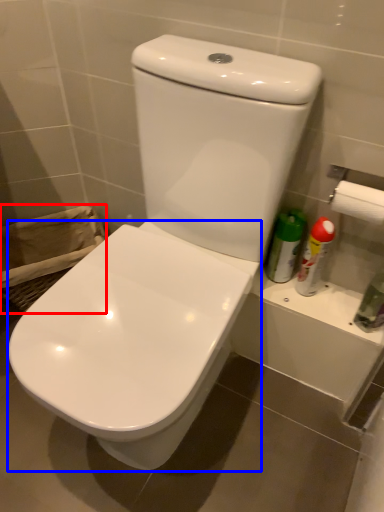
Question: Among these objects, which one is farthest to the camera, laundry basket (highlighted by a red box) or toilet (highlighted by a blue box)?

Choices:
 (A) laundry basket
 (B) toilet

Answer: (A)